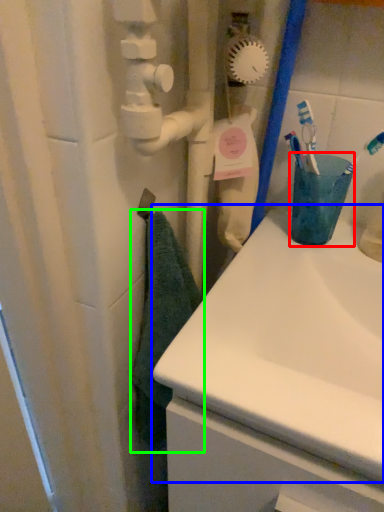
Question: Which object is the closest to the turquoise (highlighted by a red box)? Choose among these: sink (highlighted by a blue box) or bath towel (highlighted by a green box).

Choices:
 (A) sink
 (B) bath towel

Answer: (A)